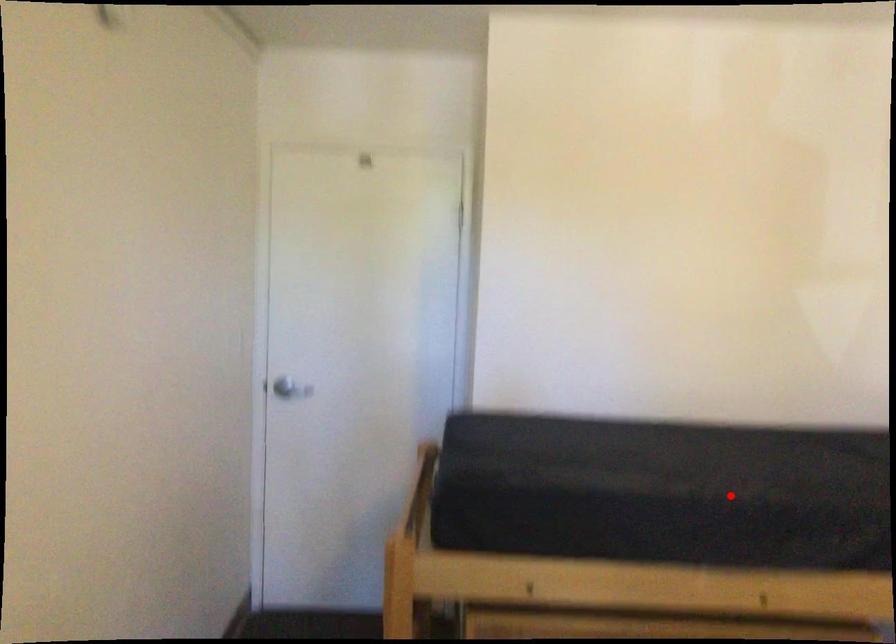
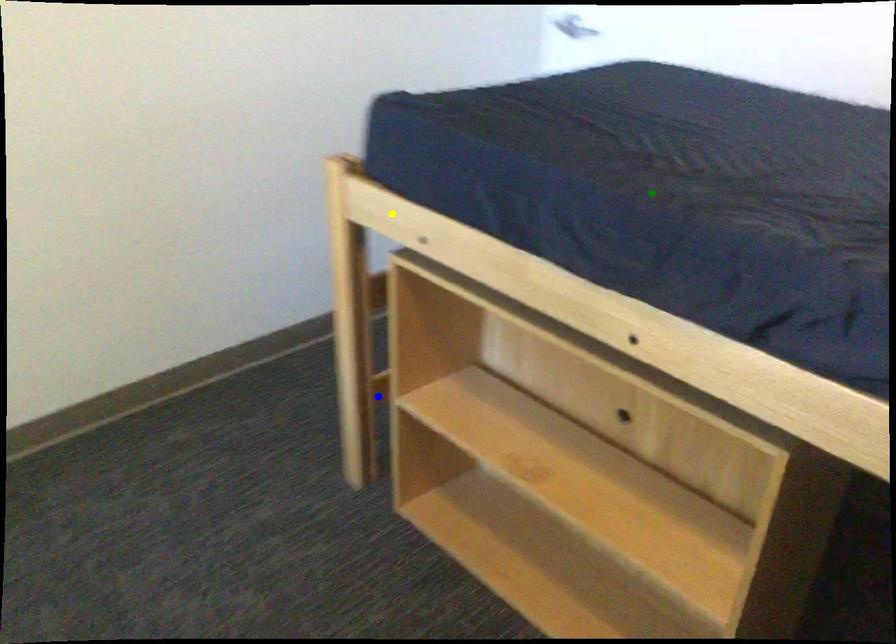
Question: I am providing you with two images of the same scene from different viewpoints. A red point is marked on the first image. You are given multiple points on the second image. Which spot in image 2 lines up with the point in image 1?

Choices:
 (A) yellow point
 (B) green point
 (C) blue point

Answer: (B)